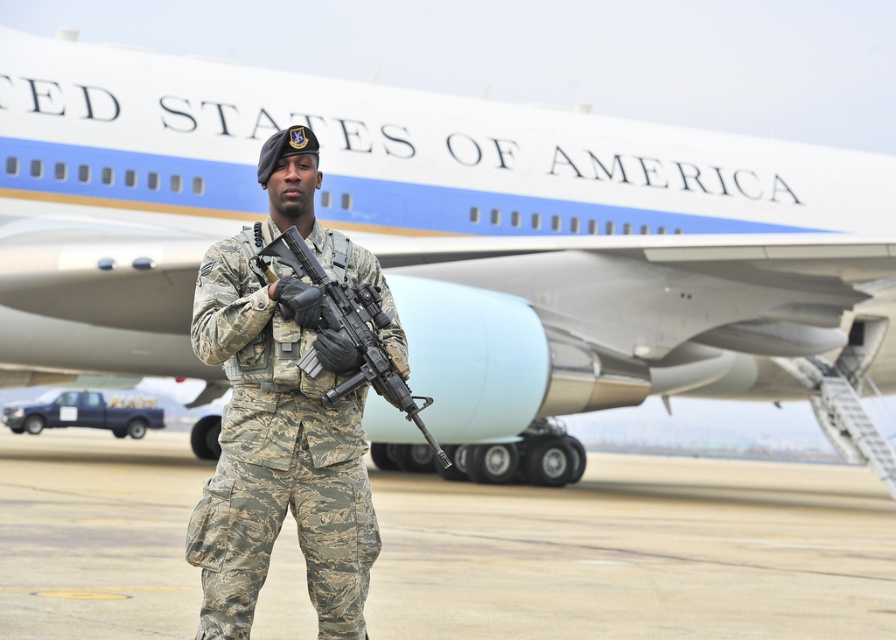
Question: Can you confirm if camouflage pants at center is wider than camouflage uniform at center?

Choices:
 (A) yes
 (B) no

Answer: (A)

Question: Which object appears closest to the camera in this image?

Choices:
 (A) white matte airplane at center
 (B) camouflage uniform at center
 (C) camouflage-patterned rifle at center
 (D) camouflage pants at center

Answer: (B)

Question: Where is camouflage uniform at center located in relation to camouflage-patterned rifle at center in the image?

Choices:
 (A) left
 (B) right

Answer: (A)

Question: Is camouflage pants at center thinner than camouflage uniform at center?

Choices:
 (A) yes
 (B) no

Answer: (B)

Question: Among these points, which one is farthest from the camera?

Choices:
 (A) (398, 372)
 (B) (207, 332)

Answer: (A)

Question: Among these objects, which one is farthest from the camera?

Choices:
 (A) camouflage-patterned rifle at center
 (B) white matte airplane at center
 (C) camouflage uniform at center
 (D) camouflage pants at center

Answer: (D)